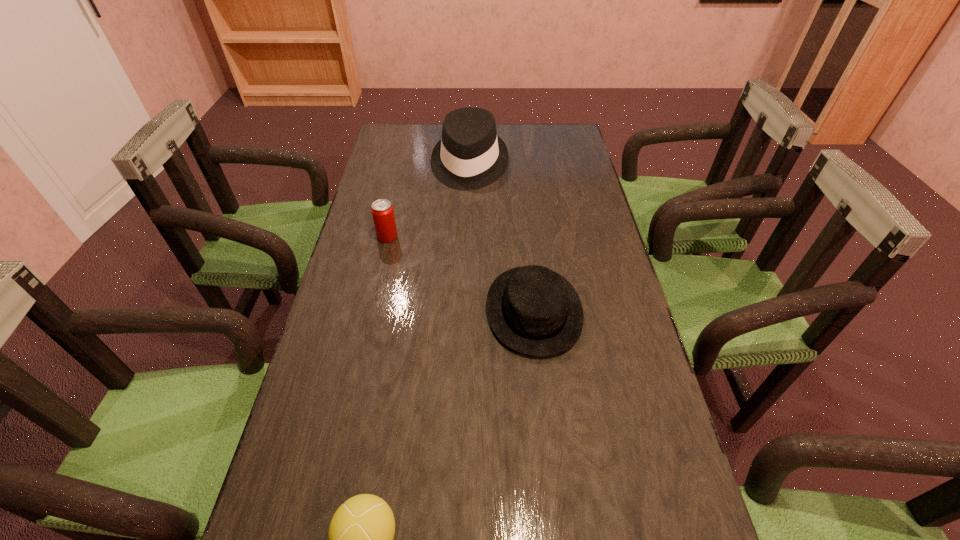
The image size is (960, 540). Identify the location of object identified as the closest to the third nearest object. point(470,155).

Locate an element on the screen. This screenshot has height=540, width=960. free location that satisfies the following two spatial constraints: 1. on the front side of the second farthest object; 2. on the left side of the shorter fedora is located at coordinates (372, 310).